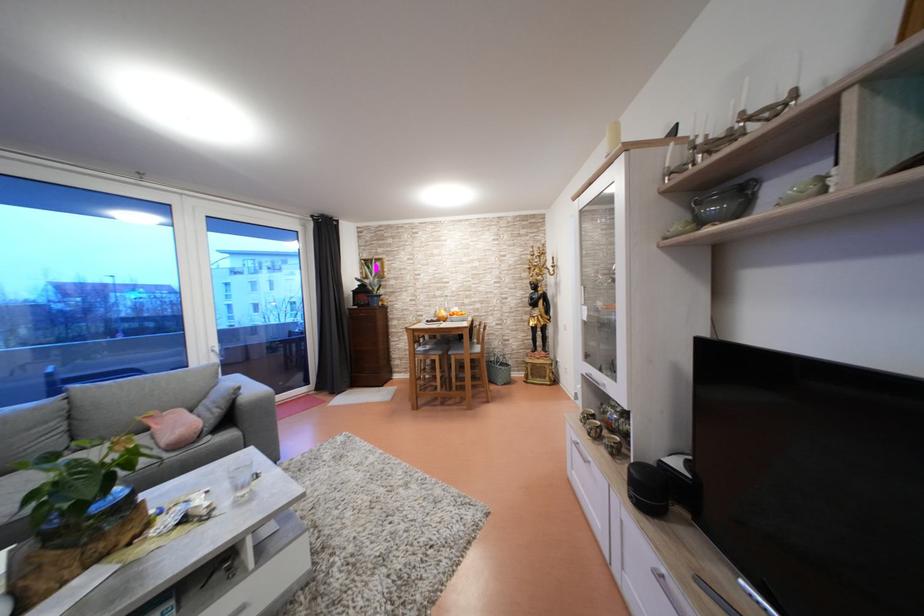
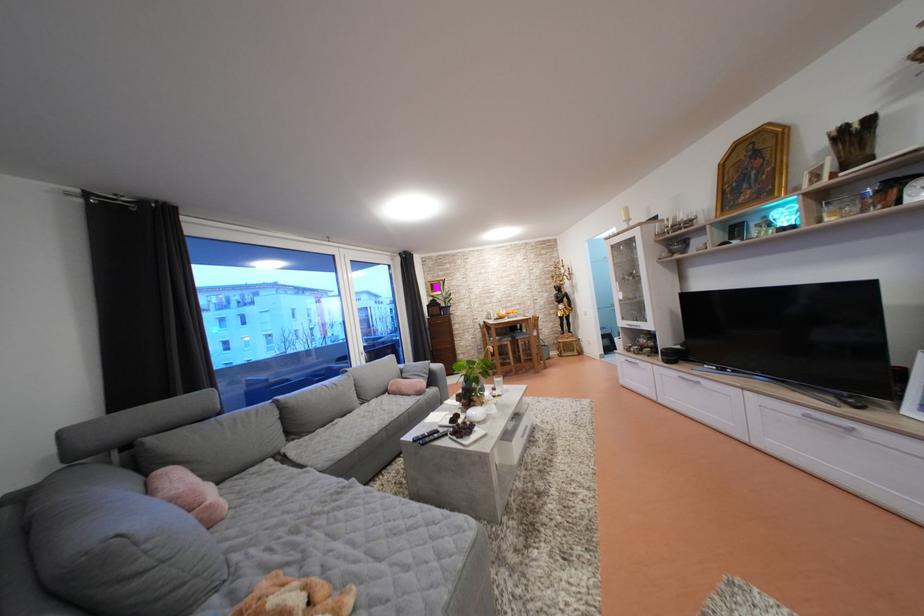
Locate, in the second image, the point that corresponds to point 593,362 in the first image.

(629, 323)